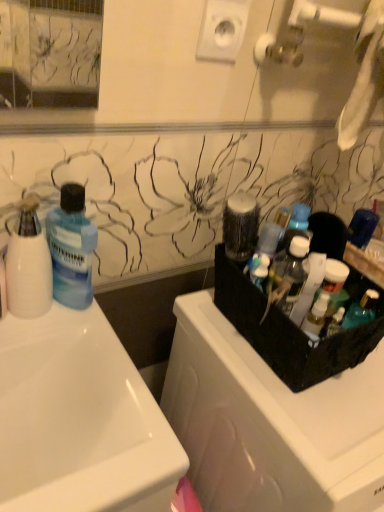
Question: Is white glossy sink at left wider or thinner than translucent plastic bottles at right, placed as the 1th cleaning product when sorted from right to left?

Choices:
 (A) wide
 (B) thin

Answer: (A)

Question: Based on their positions, is white glossy sink at left located to the left or right of translucent plastic bottles at right, which appears as the 2th cleaning product when viewed from the left?

Choices:
 (A) right
 (B) left

Answer: (B)

Question: Estimate the real-world distances between objects in this image. Which object is farther from the white glossy sink at left?

Choices:
 (A) black plastic dish washer at right
 (B) blue translucent liquid at left
 (C) translucent plastic bottles at right, which appears as the 2th cleaning product when viewed from the left
 (D) white matte cup at left, which is the 2th cleaning product in right-to-left order
 (E) translucent plastic container at upper right

Answer: (E)

Question: Which of these objects is positioned closest to the translucent plastic bottles at right, which appears as the 2th cleaning product when viewed from the left?

Choices:
 (A) white glossy sink at left
 (B) white matte cup at left, which is the 2th cleaning product in right-to-left order
 (C) blue translucent liquid at left
 (D) black plastic dish washer at right
 (E) translucent plastic container at upper right

Answer: (E)